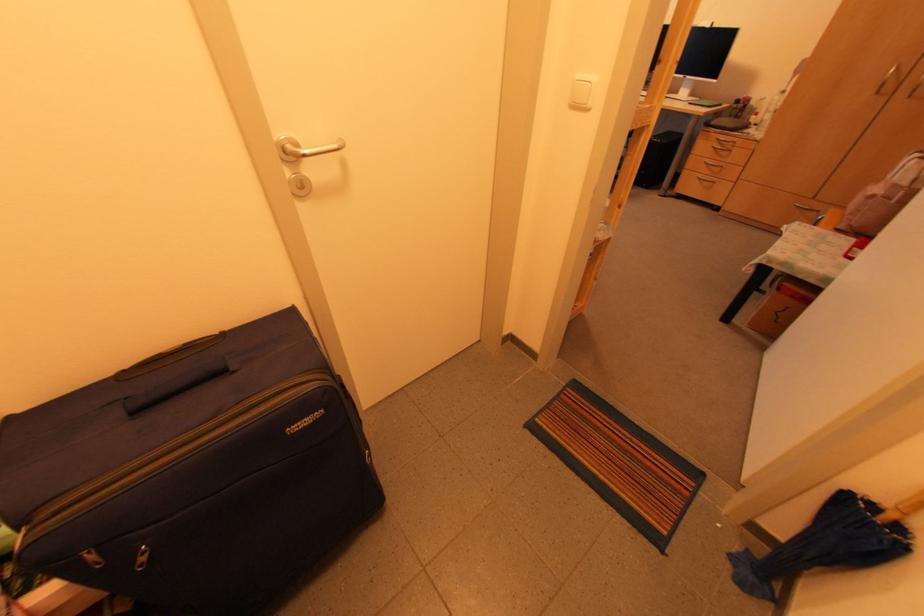
The image size is (924, 616). I want to click on drawer handle, so click(726, 140).